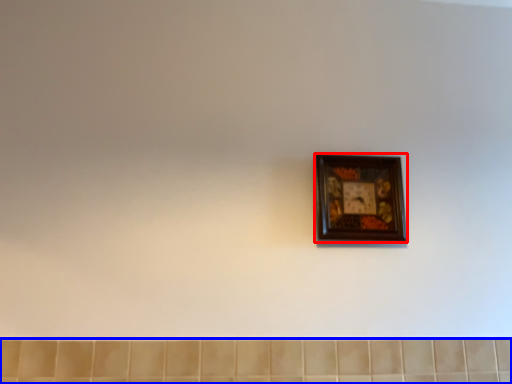
Question: Which object appears farthest to the camera in this image, picture frame (highlighted by a red box) or ceramic tile (highlighted by a blue box)?

Choices:
 (A) picture frame
 (B) ceramic tile

Answer: (A)